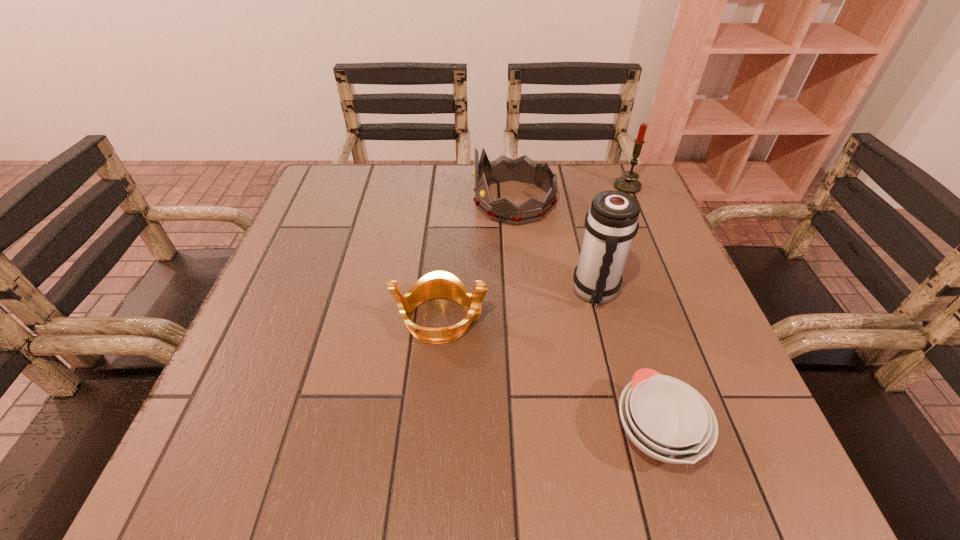
This screenshot has width=960, height=540. Find the location of `vacant area that lies between the tallest object and the taller tiara`. vacant area that lies between the tallest object and the taller tiara is located at coordinates (555, 247).

Where is `vacant area between the second tallest object and the nearest object`? The width and height of the screenshot is (960, 540). vacant area between the second tallest object and the nearest object is located at coordinates (641, 308).

Image resolution: width=960 pixels, height=540 pixels. Find the location of `free space between the farther tiara and the thermos bottle`. free space between the farther tiara and the thermos bottle is located at coordinates (555, 247).

What are the coordinates of `vacant area that lies between the nearer tiara and the second tallest object` in the screenshot? It's located at (534, 252).

The height and width of the screenshot is (540, 960). I want to click on vacant point located between the tallest object and the nearer tiara, so click(x=518, y=305).

Identify the location of free space between the soup bowl and the second shortest object. Image resolution: width=960 pixels, height=540 pixels. (548, 375).

You are a GUI agent. You are given a task and a screenshot of the screen. Output one action in this format:
    pyautogui.click(x=<x>, y=<y>)
    Task: Click on the free point between the taller tiara and the candle
    The height and width of the screenshot is (540, 960).
    Given the screenshot: What is the action you would take?
    pyautogui.click(x=570, y=194)

The width and height of the screenshot is (960, 540). Identify the location of vacant area that lies between the taller tiara and the thermos bottle. (555, 247).

Locate an element on the screen. This screenshot has height=540, width=960. vacant area between the rightmost object and the third shortest object is located at coordinates (570, 194).

Where is `free spot between the soup bowl and the shorter tiara`? This screenshot has width=960, height=540. free spot between the soup bowl and the shorter tiara is located at coordinates (548, 375).